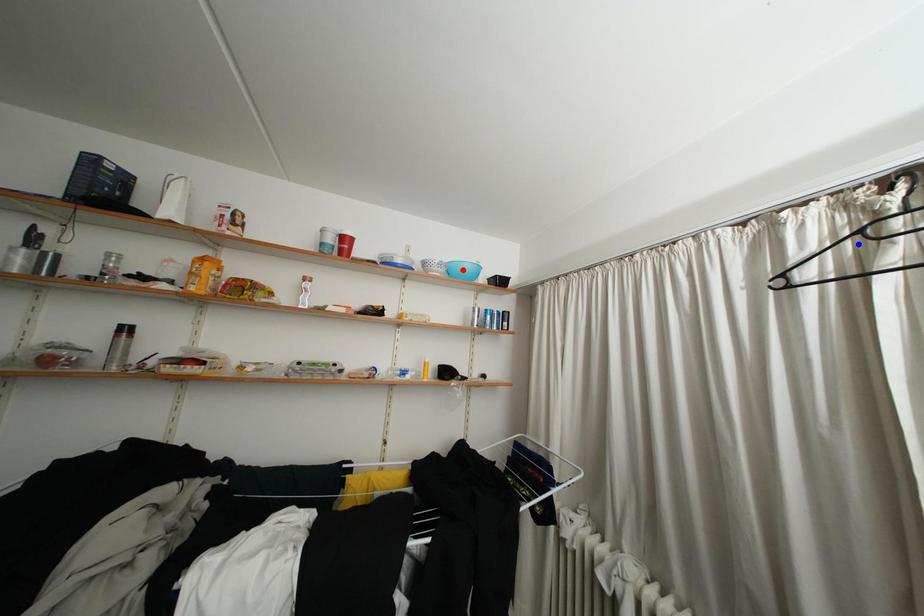
Question: In the image, two points are highlighted. Which point is nearer to the camera? Reply with the corresponding letter.

Choices:
 (A) blue point
 (B) red point

Answer: (A)